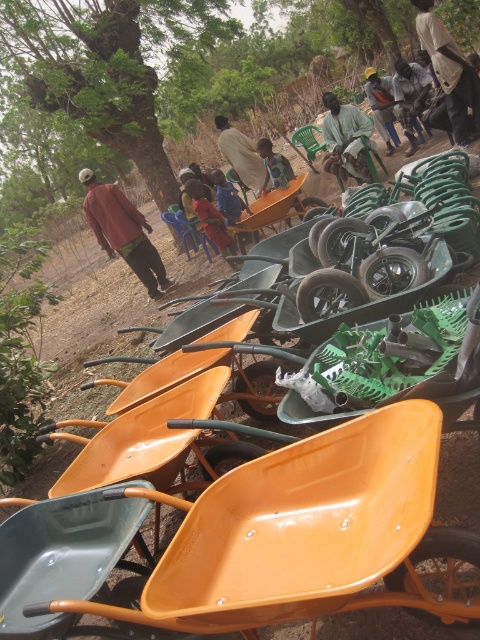
You are a photographer standing in front of the wheelbarrows and garden tools. You notice two people wearing light brown fabric shirt at center and light beige fabric at center. Which person is positioned to the right side?

The light brown fabric shirt at center is positioned to the right of light beige fabric at center, so the person wearing the light brown fabric shirt at center is on the right side.

You are a photographer taking a picture of the light brown fabric shirt at center and the light beige fabric at center. Which one should you focus on if you want to capture the taller object in the scene?

The light brown fabric shirt at center is taller than the light beige fabric at center, so you should focus on the light brown fabric shirt at center to capture the taller object.